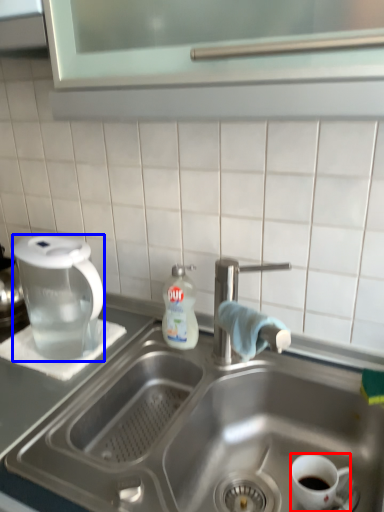
Question: Which object appears farthest to the camera in this image, coffee cup (highlighted by a red box) or coffee maker (highlighted by a blue box)?

Choices:
 (A) coffee cup
 (B) coffee maker

Answer: (B)